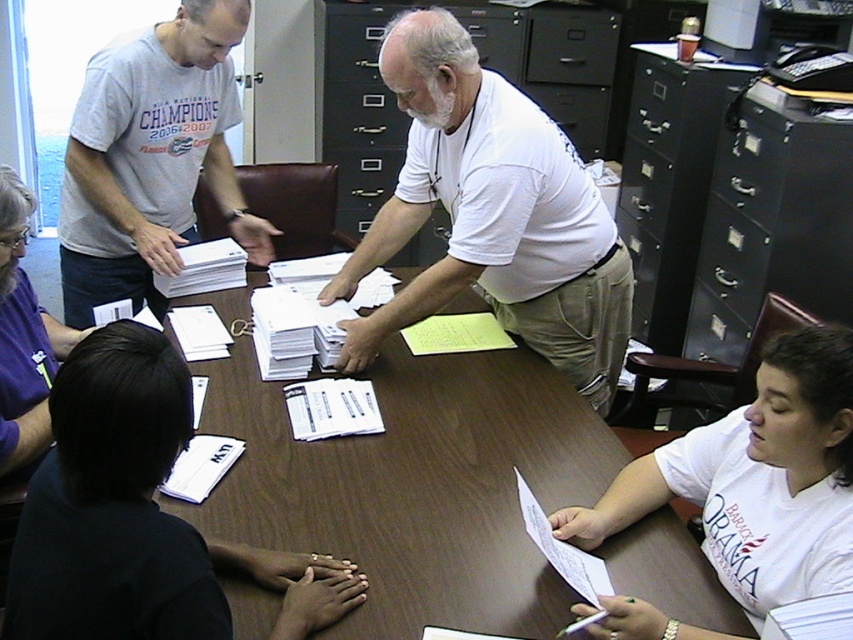
Question: Is white matte shirt at center behind white cotton shirt at lower right?

Choices:
 (A) yes
 (B) no

Answer: (A)

Question: Estimate the real-world distances between objects in this image. Which object is closer to the black metal file cabinet at right?

Choices:
 (A) brown wooden table at center
 (B) gray cotton t-shirt at upper left
 (C) white cotton shirt at lower right
 (D) black matte shirt at lower left

Answer: (A)

Question: Which of the following is the closest to the observer?

Choices:
 (A) (529, 524)
 (B) (695, 454)
 (C) (741, 93)

Answer: (A)

Question: Is brown wooden table at center above gray cotton t-shirt at upper left?

Choices:
 (A) yes
 (B) no

Answer: (B)

Question: Does gray cotton t-shirt at upper left appear under black metal file cabinet at right?

Choices:
 (A) yes
 (B) no

Answer: (B)

Question: Which point is farther to the camera?

Choices:
 (A) black matte shirt at lower left
 (B) white matte shirt at center
 (C) white cotton shirt at lower right
 (D) white paper at lower right

Answer: (B)